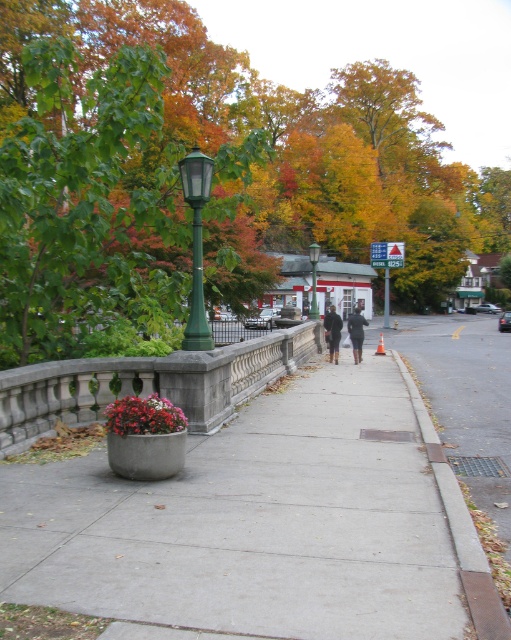
Question: Observing the image, what is the correct spatial positioning of green leafy tree at upper left in reference to gray concrete curb at lower right?

Choices:
 (A) left
 (B) right

Answer: (B)

Question: Among these objects, which one is farthest from the camera?

Choices:
 (A) concrete sidewalk at center
 (B) green leafy tree at upper left
 (C) dark brown leather boots at center

Answer: (C)

Question: Which object is positioned closest to the dark brown leather jacket at center?

Choices:
 (A) gray concrete curb at lower right
 (B) dark gray coat at center
 (C) green glass lamp post at center
 (D) green matte/glass lamp post at left

Answer: (B)

Question: Is dark brown leather jacket at center above green metal pole at center?

Choices:
 (A) no
 (B) yes

Answer: (A)

Question: Which point appears farthest from the camera in this image?

Choices:
 (A) coord(58,38)
 (B) coord(388,289)

Answer: (B)

Question: From the image, what is the correct spatial relationship of concrete sidewalk at center in relation to gray concrete curb at lower right?

Choices:
 (A) above
 (B) below

Answer: (B)